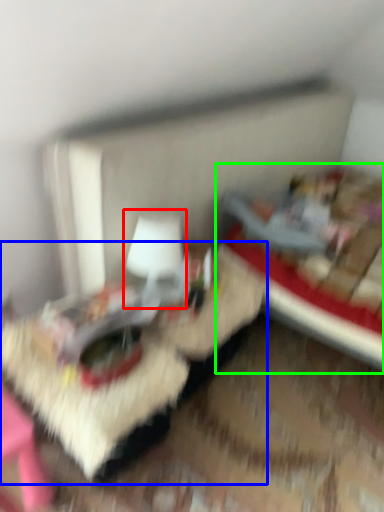
Question: Which is farther away from table lamp (highlighted by a red box)? table (highlighted by a blue box) or bed (highlighted by a green box)?

Choices:
 (A) table
 (B) bed

Answer: (B)